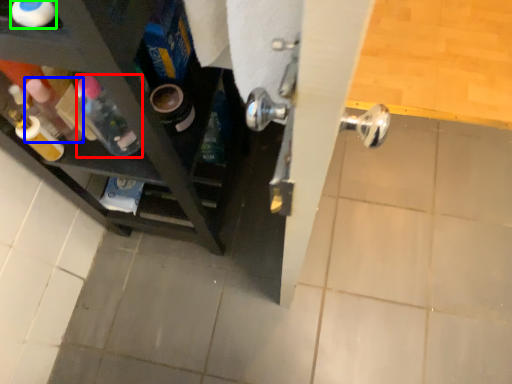
Question: Estimate the real-world distances between objects in this image. Which object is closer to bottle (highlighted by a red box), bottle (highlighted by a blue box) or bottle (highlighted by a green box)?

Choices:
 (A) bottle
 (B) bottle

Answer: (A)